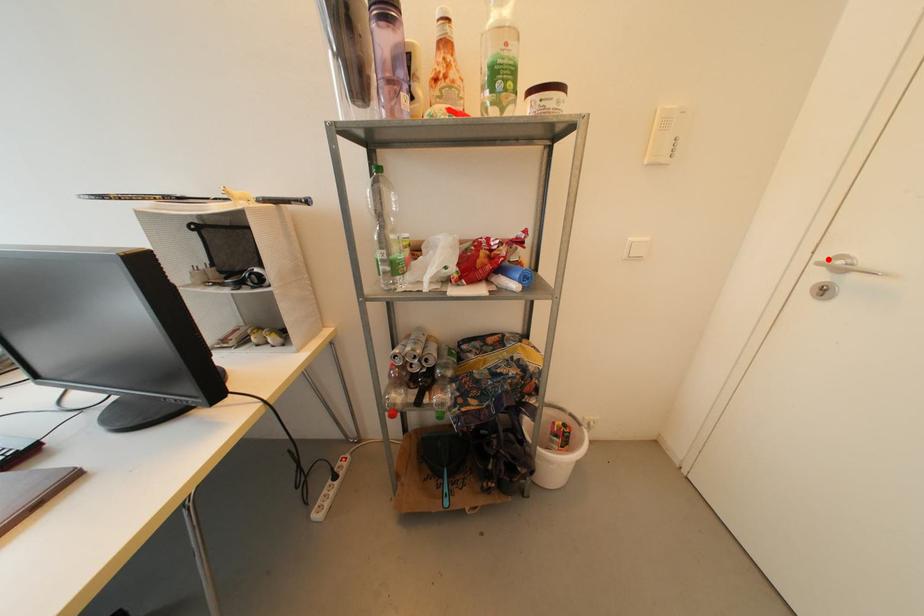
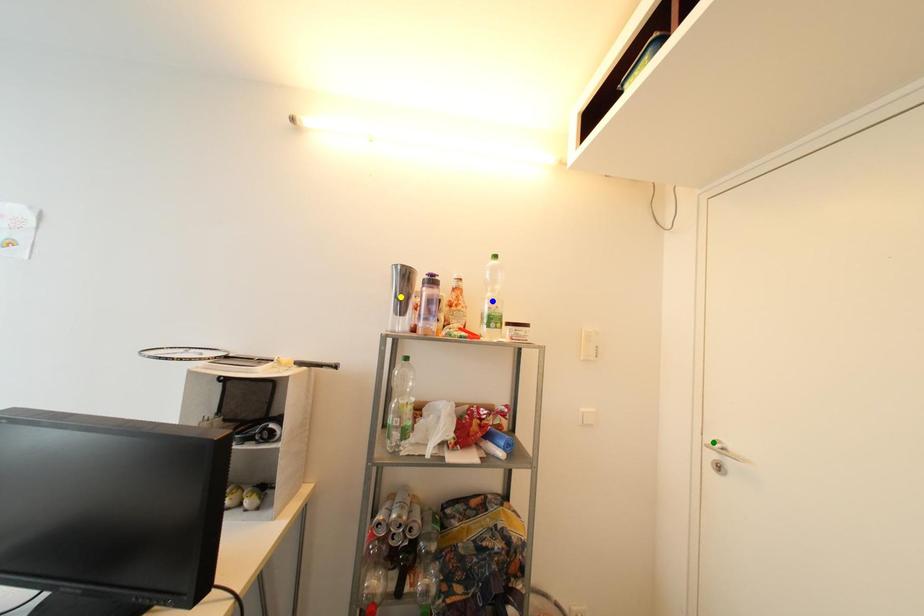
Question: I am providing you with two images of the same scene from different viewpoints. A red point is marked on the first image. You are given multiple points on the second image. Which point in image 2 represents the same 3d spot as the red point in image 1?

Choices:
 (A) yellow point
 (B) green point
 (C) blue point

Answer: (B)